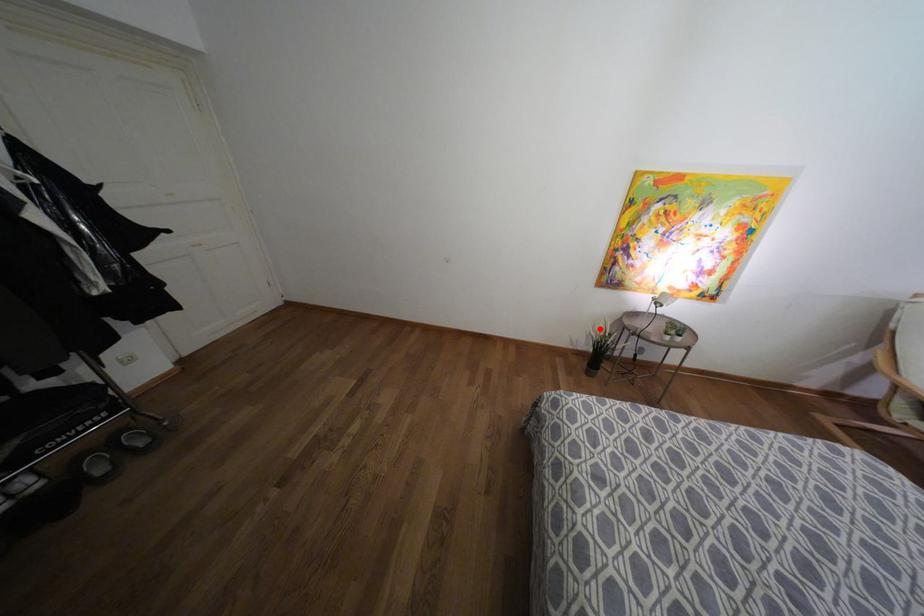
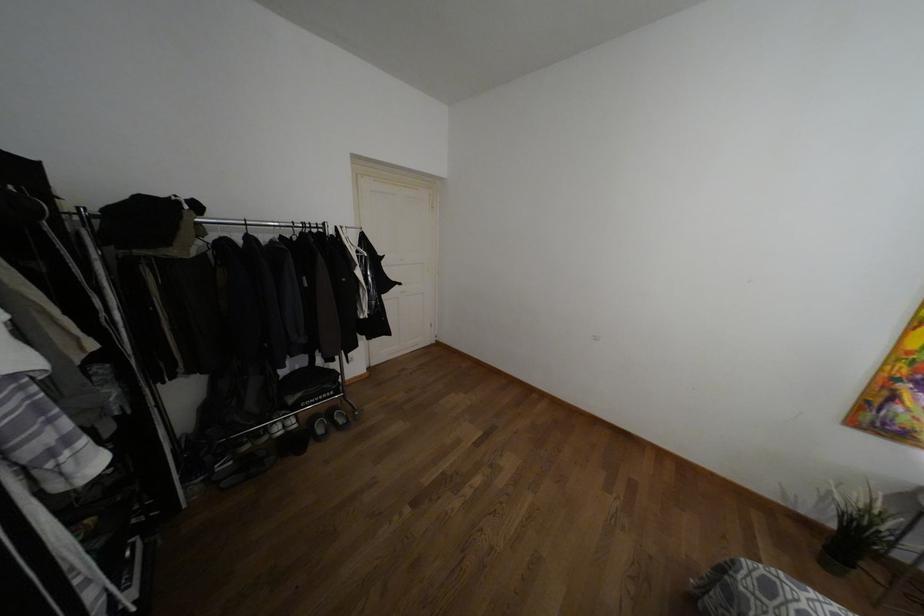
Find the pixel in the second image that matches the highlighted location in the first image.

(855, 496)